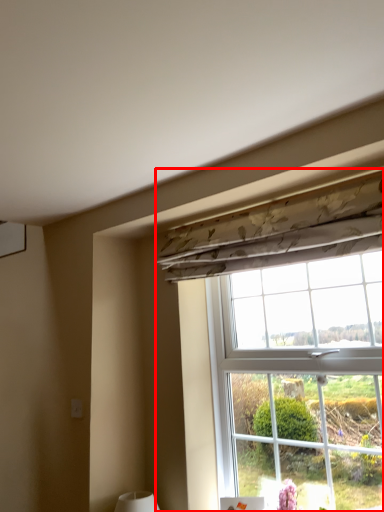
Question: Observing the image, what is the correct spatial positioning of window (annotated by the red box) in reference to curtain?

Choices:
 (A) right
 (B) left

Answer: (A)